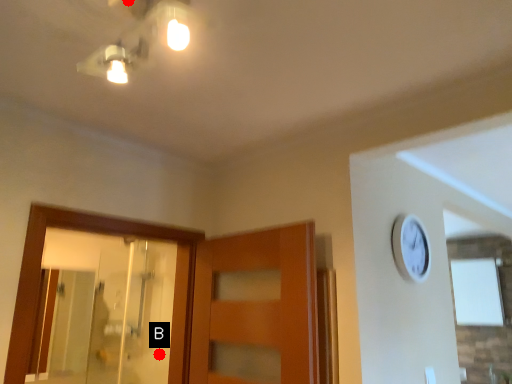
Question: Two points are circled on the image, labeled by A and B beside each circle. Which point appears closest to the camera in this image?

Choices:
 (A) A is closer
 (B) B is closer

Answer: (A)